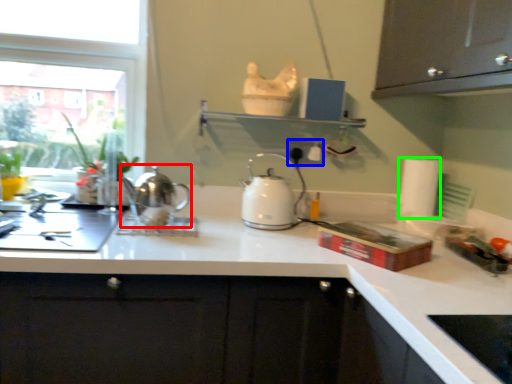
Question: Based on their relative distances, which object is farther from kettle (highlighted by a red box)? Choose from electric outlet (highlighted by a blue box) and paper towel (highlighted by a green box).

Choices:
 (A) electric outlet
 (B) paper towel

Answer: (B)